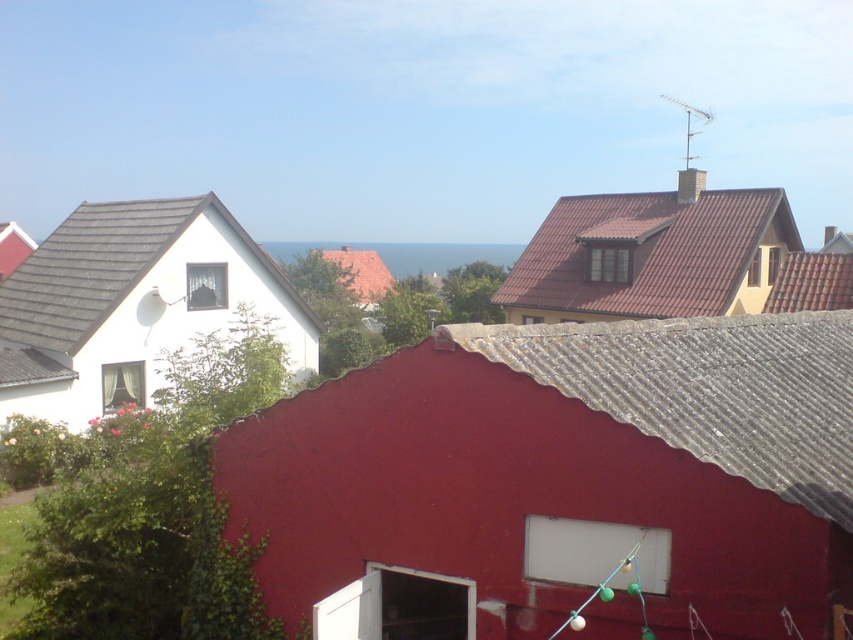
Does point (51, 304) come farther from viewer compared to point (372, 269)?

That is False.

Who is taller, gray shingles at left or red tile roof at center?

red tile roof at center

Which is behind, point (74, 346) or point (369, 289)?

The point (369, 289) is behind.

At what (x,y) coordinates should I click in order to perform the action: click on gray shingles at left. Please return your answer as a coordinate pair (x, y). This screenshot has height=640, width=853. Looking at the image, I should click on (103, 268).

Is point (573, 232) positioned in front of point (132, 212)?

No, (573, 232) is behind (132, 212).

This screenshot has height=640, width=853. Identify the location of brown tile roof at upper right. point(653,253).

Looking at this image, is brown tile roof at upper right shorter than red tile roof at center?

Indeed, brown tile roof at upper right has a lesser height compared to red tile roof at center.

Which is behind, point (543, 305) or point (392, 280)?

Positioned behind is point (392, 280).

Which is in front, point (596, 257) or point (340, 275)?

Positioned in front is point (596, 257).

In order to click on brown tile roof at upper right in this screenshot , I will do `click(653, 253)`.